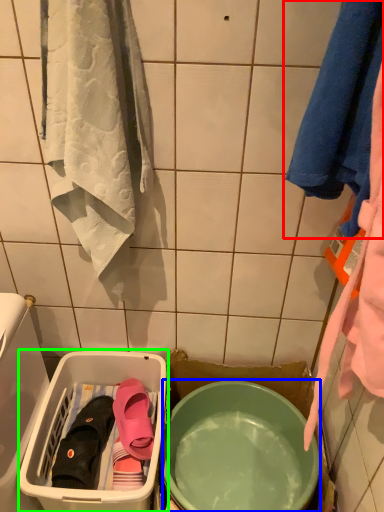
Question: Estimate the real-world distances between objects in this image. Which object is closer to towel (highlighted by a red box), mixing bowl (highlighted by a blue box) or laundry basket (highlighted by a green box)?

Choices:
 (A) mixing bowl
 (B) laundry basket

Answer: (A)